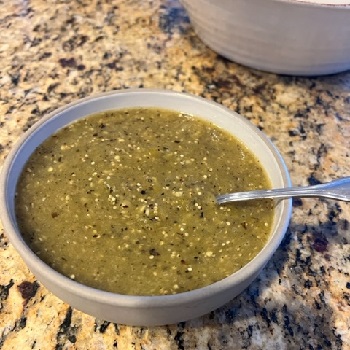
At what (x,y) coordinates should I click in order to perform the action: click on handle. Please return your answer as a coordinate pair (x, y). The image size is (350, 350). Looking at the image, I should click on (297, 193).